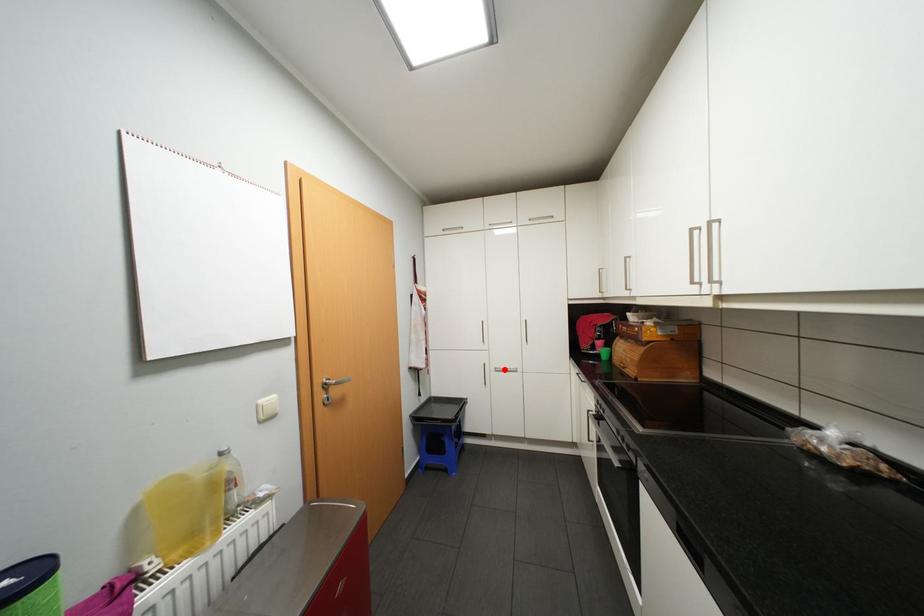
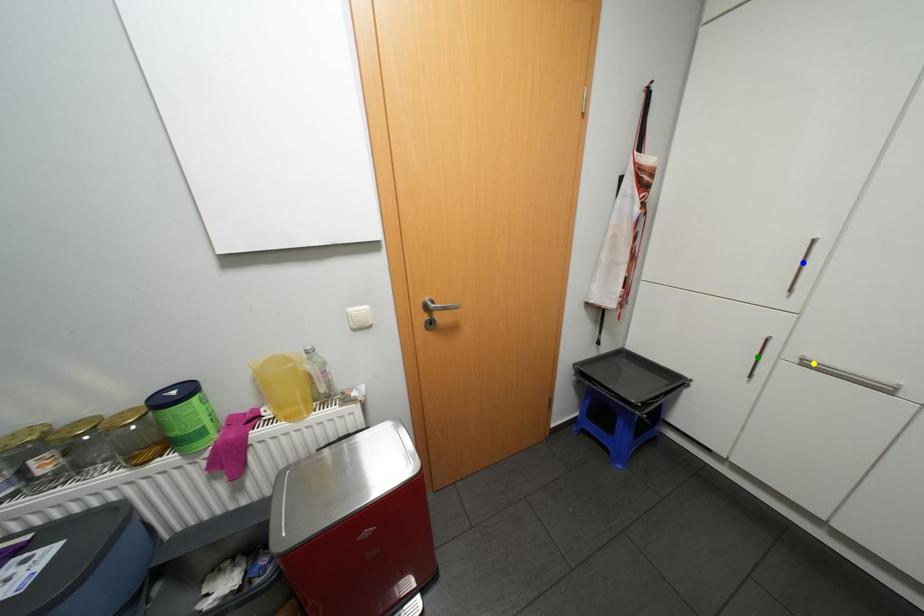
Question: I am providing you with two images of the same scene from different viewpoints. A red point is marked on the first image. You are given multiple points on the second image. Can you choose the point in image 2 that corresponds to the point in image 1?

Choices:
 (A) blue point
 (B) green point
 (C) yellow point

Answer: (C)